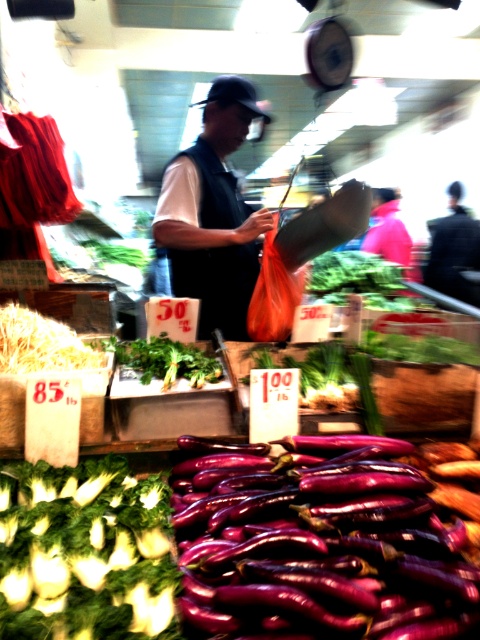
Question: Does dark blue vest at center have a larger size compared to green leafy at center?

Choices:
 (A) yes
 (B) no

Answer: (A)

Question: Among these objects, which one is farthest from the camera?

Choices:
 (A) green leafy at center
 (B) dark blue vest at center

Answer: (B)

Question: Is dark blue vest at center thinner than dark blue jeans at center?

Choices:
 (A) no
 (B) yes

Answer: (B)

Question: Based on their relative distances, which object is nearer to the purple glossy eggplant at lower center?

Choices:
 (A) dark blue jeans at center
 (B) green leafy at lower left
 (C) dark blue vest at center
 (D) green leafy at center

Answer: (B)

Question: Which of the following is the closest to the observer?

Choices:
 (A) (157, 365)
 (B) (406, 593)
 (C) (469, 268)

Answer: (B)

Question: Is green leafy at lower left to the right of dark blue vest at center from the viewer's perspective?

Choices:
 (A) yes
 (B) no

Answer: (B)